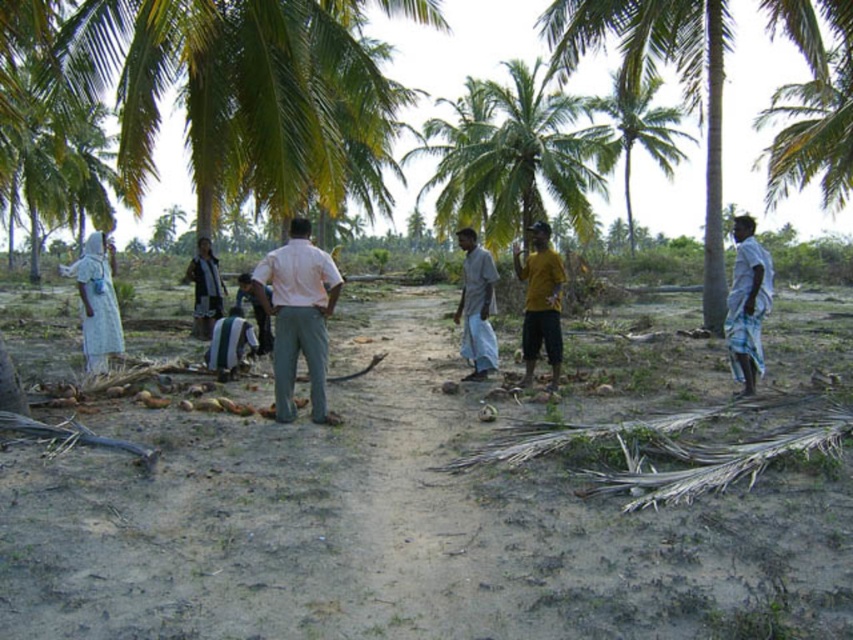
From the picture: Who is positioned more to the right, green leafy palm tree at center or dark gray fabric shirt at center?

green leafy palm tree at center

How far apart are green leafy palm tree at center and dark gray fabric shirt at center?

green leafy palm tree at center and dark gray fabric shirt at center are 14.57 meters apart.

Between point (505, 163) and point (198, 241), which one is positioned behind?

The point (505, 163) is more distant.

Find the location of a particular element. This screenshot has width=853, height=640. green leafy palm tree at center is located at coordinates coord(514,156).

Does white cloth at left have a larger size compared to light gray cotton shirt at center?

Indeed, white cloth at left has a larger size compared to light gray cotton shirt at center.

Does white cloth at left have a greater height compared to light gray cotton shirt at center?

In fact, white cloth at left may be shorter than light gray cotton shirt at center.

Where is `white cloth at left`? white cloth at left is located at coordinates tap(97, 304).

Can you confirm if brown sandy dirt field at center is positioned below dark gray fabric shirt at center?

Yes.

Who is more forward, (465,392) or (202,307)?

Point (465,392) is more forward.

Where is `brown sandy dirt field at center`? brown sandy dirt field at center is located at coordinates [x=387, y=529].

You are a GUI agent. You are given a task and a screenshot of the screen. Output one action in this format:
    pyautogui.click(x=<x>, y=<y>)
    Task: Click on the brown sandy dirt field at center
    This screenshot has height=640, width=853.
    Given the screenshot: What is the action you would take?
    pyautogui.click(x=387, y=529)